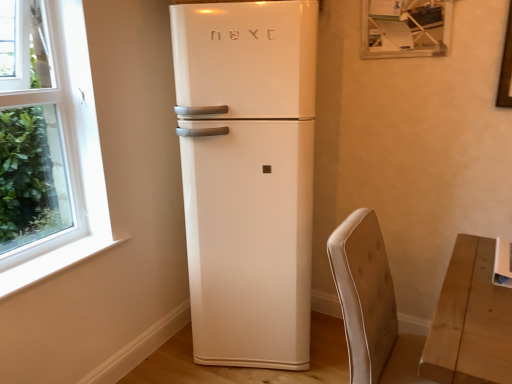
Question: Is velvet beige armchair at lower right taller or shorter than white glossy refrigerator at center?

Choices:
 (A) tall
 (B) short

Answer: (B)

Question: Is velvet beige armchair at lower right spatially inside white glossy refrigerator at center, or outside of it?

Choices:
 (A) outside
 (B) inside

Answer: (A)

Question: From a real-world perspective, is velvet beige armchair at lower right physically located above or below white glossy refrigerator at center?

Choices:
 (A) below
 (B) above

Answer: (A)

Question: Considering their positions, is white glossy refrigerator at center located in front of or behind velvet beige armchair at lower right?

Choices:
 (A) front
 (B) behind

Answer: (B)

Question: Based on their sizes in the image, would you say white glossy refrigerator at center is bigger or smaller than velvet beige armchair at lower right?

Choices:
 (A) big
 (B) small

Answer: (A)

Question: Is point (229, 87) positioned closer to the camera than point (351, 251)?

Choices:
 (A) closer
 (B) farther

Answer: (B)

Question: Would you say white glossy refrigerator at center is inside or outside velvet beige armchair at lower right?

Choices:
 (A) inside
 (B) outside

Answer: (B)